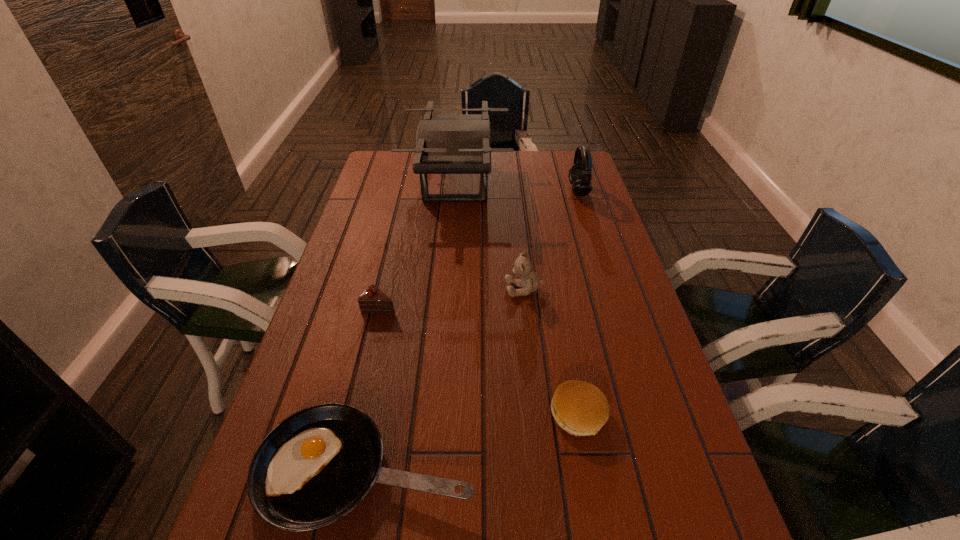
Image resolution: width=960 pixels, height=540 pixels. In order to click on drone in this screenshot , I will do `click(445, 143)`.

Where is `the second tallest object`? the second tallest object is located at coordinates (580, 173).

Locate an element on the screen. The height and width of the screenshot is (540, 960). the rightmost object is located at coordinates (580, 173).

Locate an element on the screen. Image resolution: width=960 pixels, height=540 pixels. the fourth shortest object is located at coordinates click(530, 282).

Find the location of `chocolate cake`. chocolate cake is located at coordinates (372, 300).

In order to click on patty in this screenshot , I will do `click(581, 409)`.

What are the coordinates of `frying pan` in the screenshot? It's located at (314, 467).

Find the location of a particular element. The width and height of the screenshot is (960, 540). vacant position located with a camera mounted on the underside of the drone is located at coordinates pos(548,183).

The width and height of the screenshot is (960, 540). I want to click on free space located 0.160m on the earcups of the rightmost object, so click(x=525, y=191).

This screenshot has width=960, height=540. In order to click on free region located 0.050m on the earcups of the rightmost object in this screenshot , I will do `click(556, 191)`.